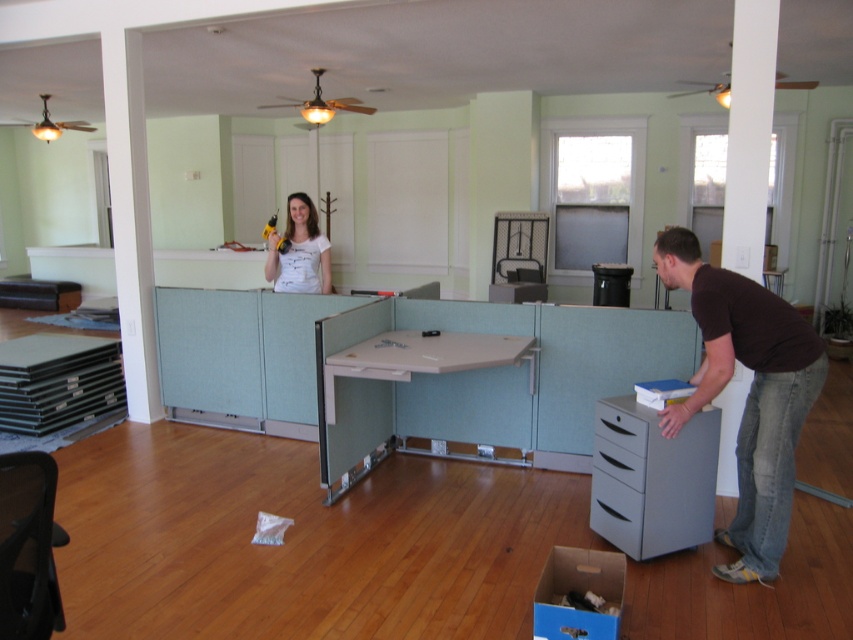
You are helping to organize the workspace. You need to place a tall plant that requires 30 cm of vertical space. Which object between the blue cardboard box at lower center and the metallic gray drawer at lower right can accommodate the plant?

The blue cardboard box at lower center has a greater height compared to the metallic gray drawer at lower right, so it can accommodate the tall plant requiring 30 cm of vertical space.